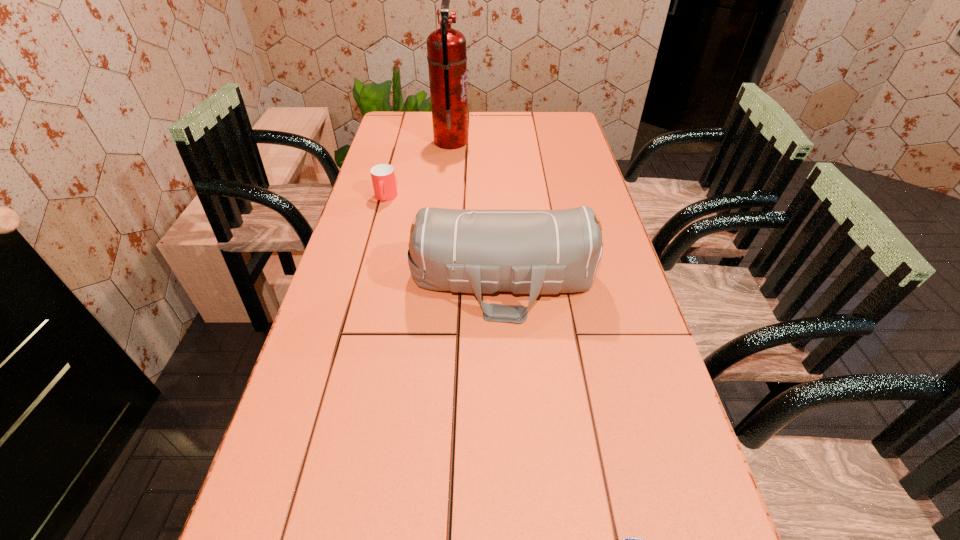
Where is `fire extinguisher`? This screenshot has width=960, height=540. fire extinguisher is located at coordinates tap(446, 48).

At what (x,y) coordinates should I click in order to perform the action: click on the farthest object. Please return your answer as a coordinate pair (x, y). Image resolution: width=960 pixels, height=540 pixels. Looking at the image, I should click on (446, 48).

Find the location of a particular element. The width and height of the screenshot is (960, 540). duffel bag is located at coordinates (538, 252).

This screenshot has width=960, height=540. Find the location of `the third farthest object`. the third farthest object is located at coordinates click(x=538, y=252).

The image size is (960, 540). I want to click on the second farthest object, so click(x=383, y=177).

Identify the location of the farther cup. The image size is (960, 540). (383, 177).

What are the coordinates of `vacant point located on the side of the farthest object with the handle and hose` in the screenshot? It's located at 494,142.

Locate an element on the screen. The height and width of the screenshot is (540, 960). vacant region located on the front of the duffel bag is located at coordinates (514, 467).

The width and height of the screenshot is (960, 540). I want to click on blank space located on the side of the leftmost object with the handle, so click(379, 222).

At what (x,y) coordinates should I click in order to perform the action: click on object that is at the far edge. Please return your answer as a coordinate pair (x, y). The image size is (960, 540). Looking at the image, I should click on (446, 48).